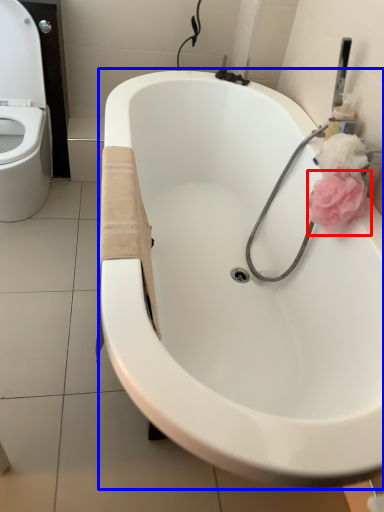
Question: Which object appears closest to the camera in this image, rose (highlighted by a red box) or bathtub (highlighted by a blue box)?

Choices:
 (A) rose
 (B) bathtub

Answer: (B)